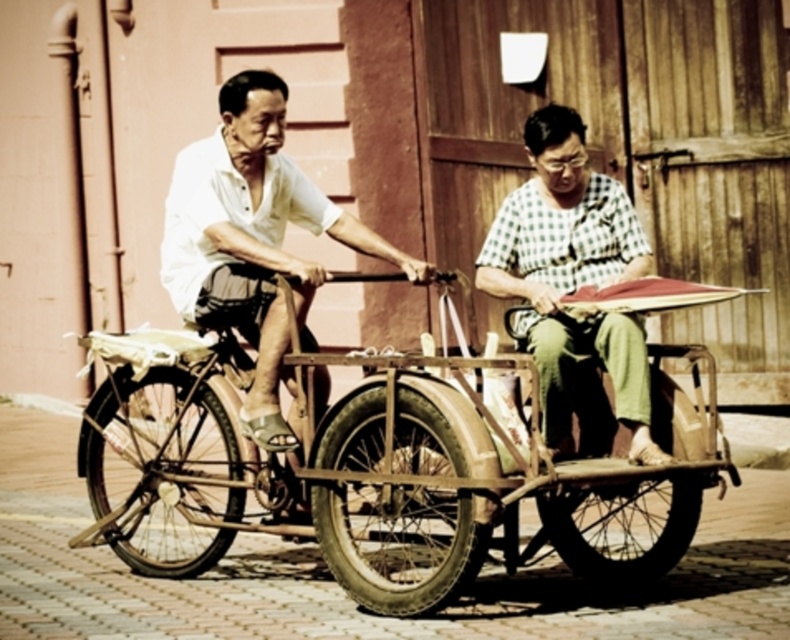
Question: Which point is closer to the camera?

Choices:
 (A) checkered fabric shirt at center
 (B) metallic brown bicycle at center

Answer: (B)

Question: Among these points, which one is nearest to the camera?

Choices:
 (A) (284, 483)
 (B) (540, 296)

Answer: (B)

Question: Which of the following is the farthest from the observer?

Choices:
 (A) metallic brown bicycle at center
 (B) checkered fabric shirt at center
 (C) white cotton shirt at center

Answer: (C)

Question: In this image, where is white cotton shirt at center located relative to checkered fabric shirt at center?

Choices:
 (A) left
 (B) right

Answer: (A)

Question: Is white cotton shirt at center wider than checkered fabric shirt at center?

Choices:
 (A) no
 (B) yes

Answer: (B)

Question: Observing the image, what is the correct spatial positioning of white cotton shirt at center in reference to checkered fabric shirt at center?

Choices:
 (A) right
 (B) left

Answer: (B)